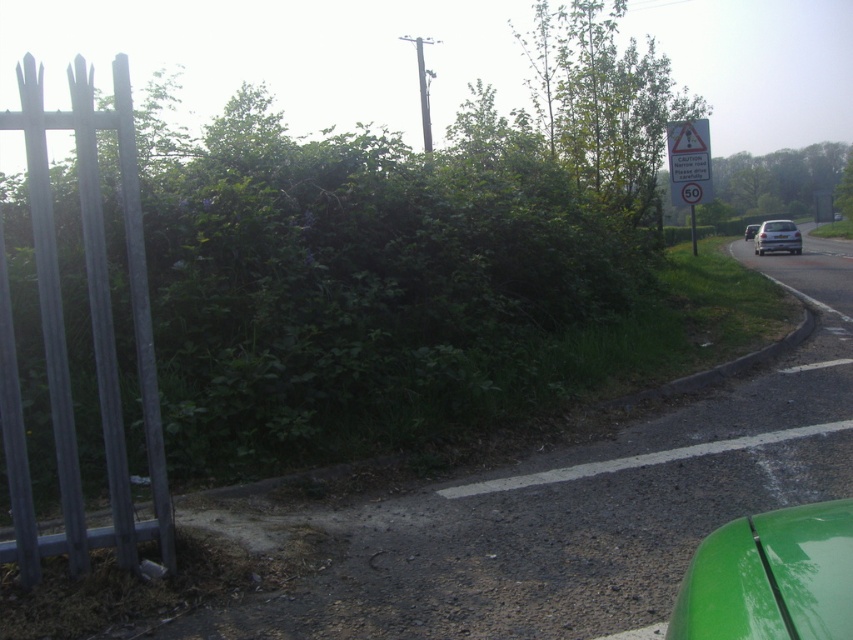
Is green glossy car at lower right further to camera compared to matte silver van at right?

No, it is not.

Is point (776, 577) positioned after point (755, 225)?

That is False.

Where is `green glossy car at lower right`? green glossy car at lower right is located at coordinates (770, 577).

In order to click on metallic gray fence at left in this screenshot , I will do `click(91, 326)`.

At what (x,y) coordinates should I click in order to perform the action: click on metallic gray fence at left. Please return your answer as a coordinate pair (x, y). This screenshot has width=853, height=640. Looking at the image, I should click on tap(91, 326).

Is green leafy hedge at left taller than white plastic sign at upper right?

Indeed, green leafy hedge at left has a greater height compared to white plastic sign at upper right.

Which is behind, point (386, 225) or point (682, 202)?

Point (682, 202)

Find the location of a particular element. This screenshot has height=640, width=853. green leafy hedge at left is located at coordinates (361, 282).